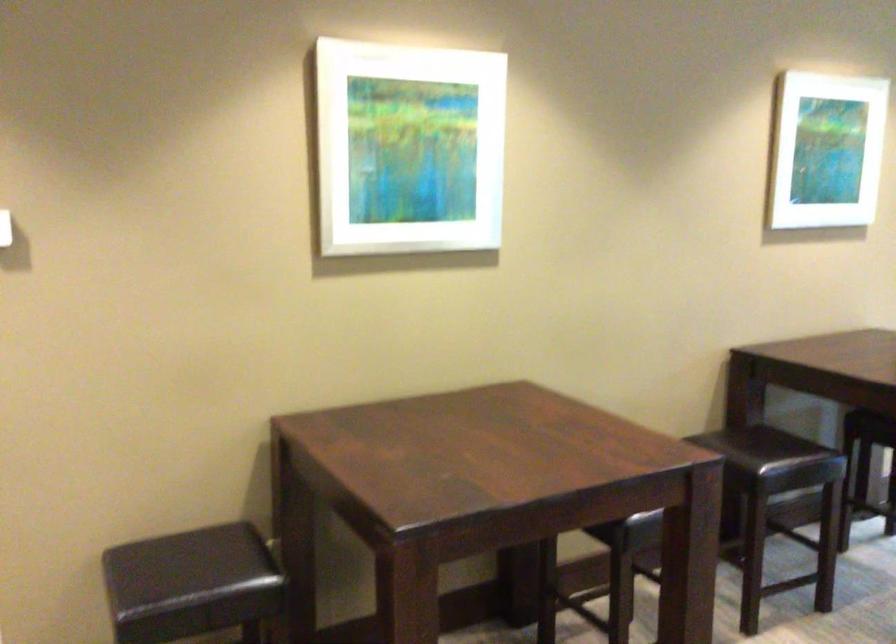
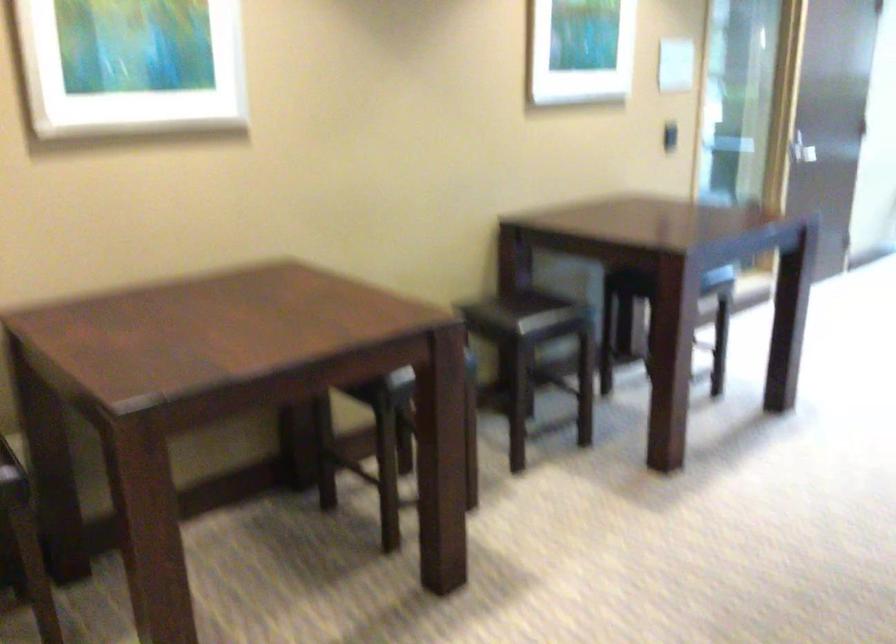
Question: The first image is from the beginning of the video and the second image is from the end. How did the camera likely rotate when shooting the video?

Choices:
 (A) Left
 (B) Right
 (C) Up
 (D) Down

Answer: (B)